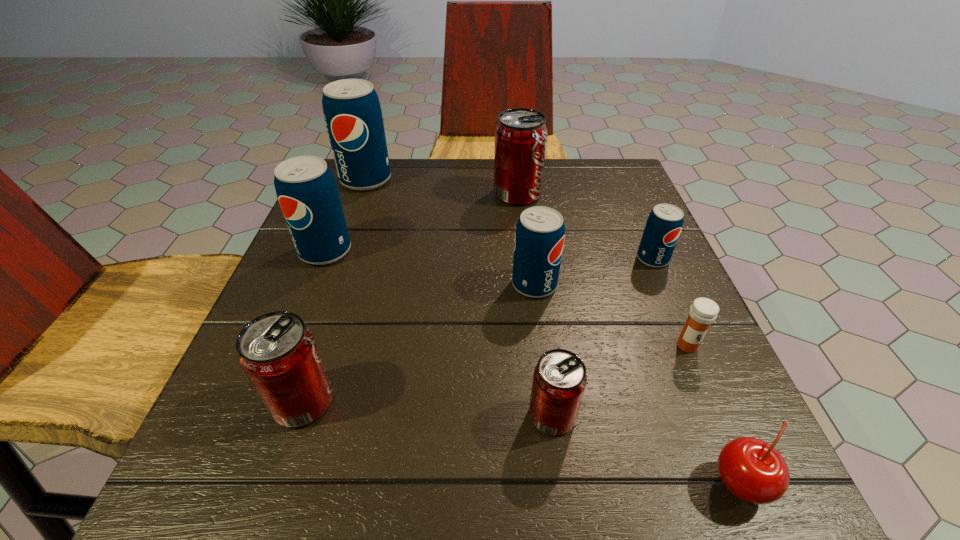
Find the location of `the tallest pop soda`. the tallest pop soda is located at coordinates tap(352, 112).

Locate an element on the screen. This screenshot has width=960, height=540. the farthest blue pop is located at coordinates (352, 112).

Image resolution: width=960 pixels, height=540 pixels. Identify the location of the biggest red pop soda. (520, 136).

The width and height of the screenshot is (960, 540). I want to click on the third smallest blue pop, so click(306, 189).

At what (x,y) coordinates should I click in order to perform the action: click on the fifth farthest object. Please return your answer as a coordinate pair (x, y). The image size is (960, 540). Looking at the image, I should click on (540, 231).

Find the location of a particular element. The image size is (960, 540). the nearest blue pop is located at coordinates (540, 231).

The width and height of the screenshot is (960, 540). I want to click on the second biggest red pop soda, so click(x=277, y=351).

Where is `the smallest blue pop`? The height and width of the screenshot is (540, 960). the smallest blue pop is located at coordinates (664, 224).

Locate an element on the screen. This screenshot has width=960, height=540. the rightmost blue pop is located at coordinates (664, 224).

Where is `the smallest red pop soda`? The width and height of the screenshot is (960, 540). the smallest red pop soda is located at coordinates (559, 380).